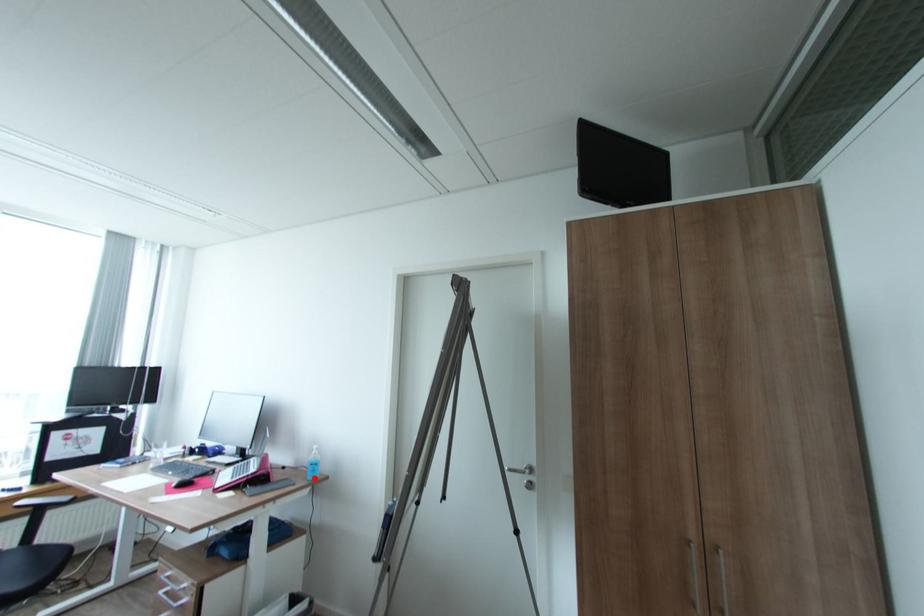
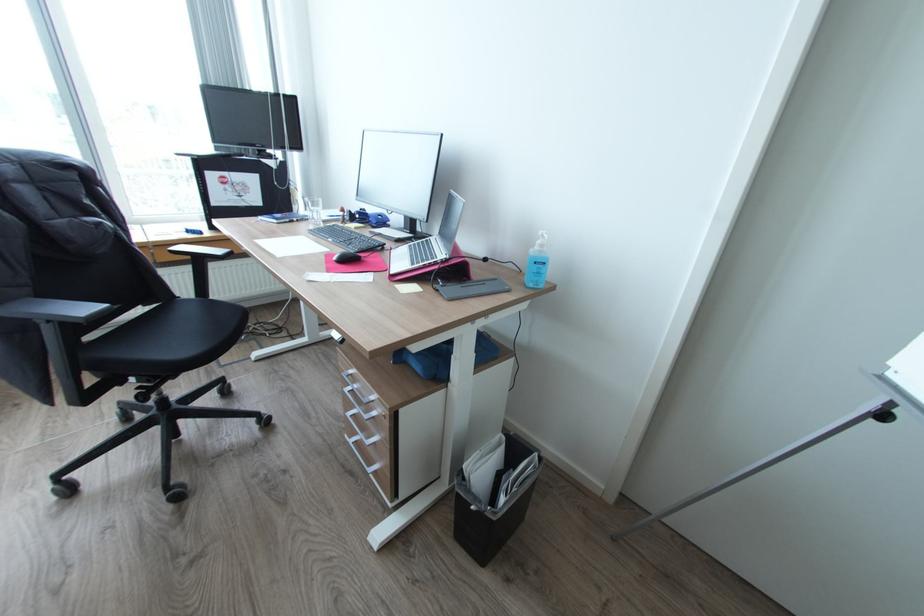
Where in the second image is the point corresponding to the highlighted location from the first image?

(536, 284)